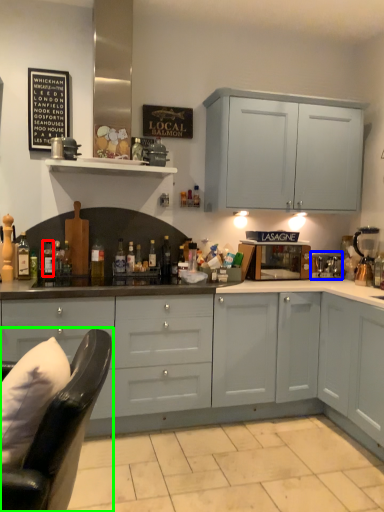
Question: Which object is the farthest from bottle (highlighted by a red box)? Choose among these: appliance (highlighted by a blue box) or swivel chair (highlighted by a green box).

Choices:
 (A) appliance
 (B) swivel chair

Answer: (B)